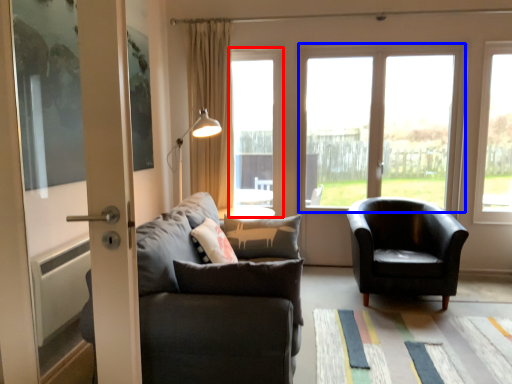
Question: Which point is further to the camera, window (highlighted by a red box) or window (highlighted by a blue box)?

Choices:
 (A) window
 (B) window

Answer: (A)